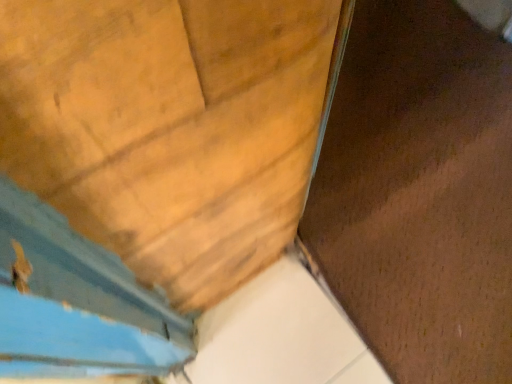
Question: From the image's perspective, is wooden door at center above or below brown matte plywood at center?

Choices:
 (A) below
 (B) above

Answer: (A)

Question: Visually, is wooden door at center positioned to the left or to the right of brown matte plywood at center?

Choices:
 (A) right
 (B) left

Answer: (B)

Question: Relative to brown matte plywood at center, is wooden door at center in front or behind?

Choices:
 (A) front
 (B) behind

Answer: (A)

Question: From the image's perspective, is brown matte plywood at center located above or below wooden door at center?

Choices:
 (A) below
 (B) above

Answer: (B)

Question: From a real-world perspective, is brown matte plywood at center positioned above or below wooden door at center?

Choices:
 (A) above
 (B) below

Answer: (B)

Question: Visually, is brown matte plywood at center positioned to the left or to the right of wooden door at center?

Choices:
 (A) right
 (B) left

Answer: (A)

Question: Does point (394, 81) appear closer or farther from the camera than point (147, 129)?

Choices:
 (A) farther
 (B) closer

Answer: (A)